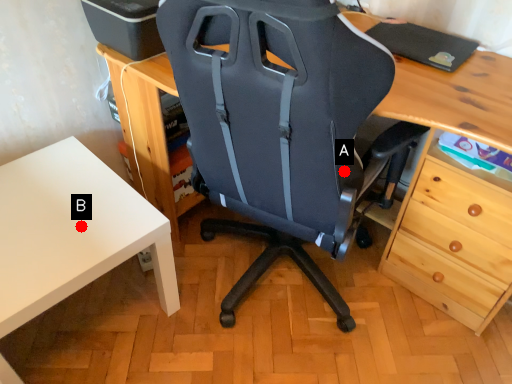
Question: Two points are circled on the image, labeled by A and B beside each circle. Which point appears farthest from the camera in this image?

Choices:
 (A) A is further
 (B) B is further

Answer: (B)